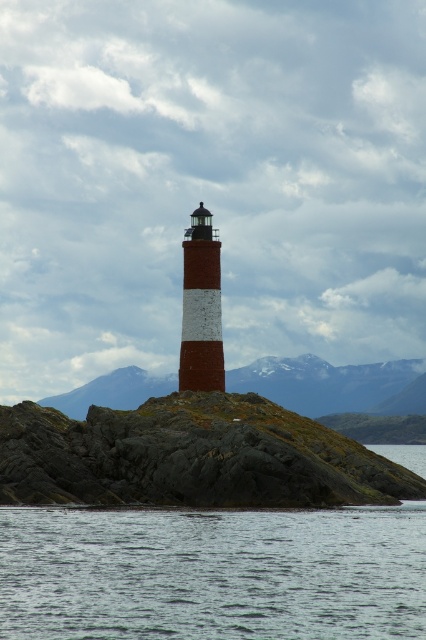
Is gray water at lower center behind brick textured lighthouse at center?

No.

Is gray water at lower center wider than brick textured lighthouse at center?

Indeed, gray water at lower center has a greater width compared to brick textured lighthouse at center.

Does point (187, 538) lie in front of point (210, 230)?

Yes, it is.

This screenshot has width=426, height=640. I want to click on gray water at lower center, so pos(213,573).

Which is below, gray water at lower center or rough granite rock at center?

gray water at lower center

Can you confirm if gray water at lower center is smaller than rough granite rock at center?

Indeed, gray water at lower center has a smaller size compared to rough granite rock at center.

Identify the location of gray water at lower center. (213, 573).

Is rough granite rock at center wider than brick textured lighthouse at center?

Yes.

Is the position of rough granite rock at center more distant than that of brick textured lighthouse at center?

No, rough granite rock at center is in front of brick textured lighthouse at center.

Which is behind, point (5, 417) or point (196, 216)?

Point (196, 216)

The width and height of the screenshot is (426, 640). What are the coordinates of `rough granite rock at center` in the screenshot? It's located at (190, 456).